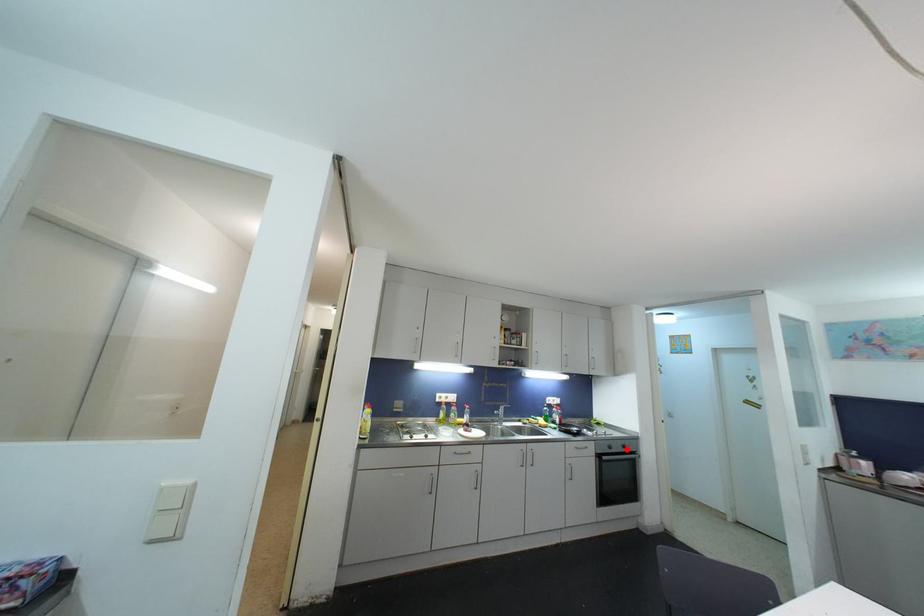
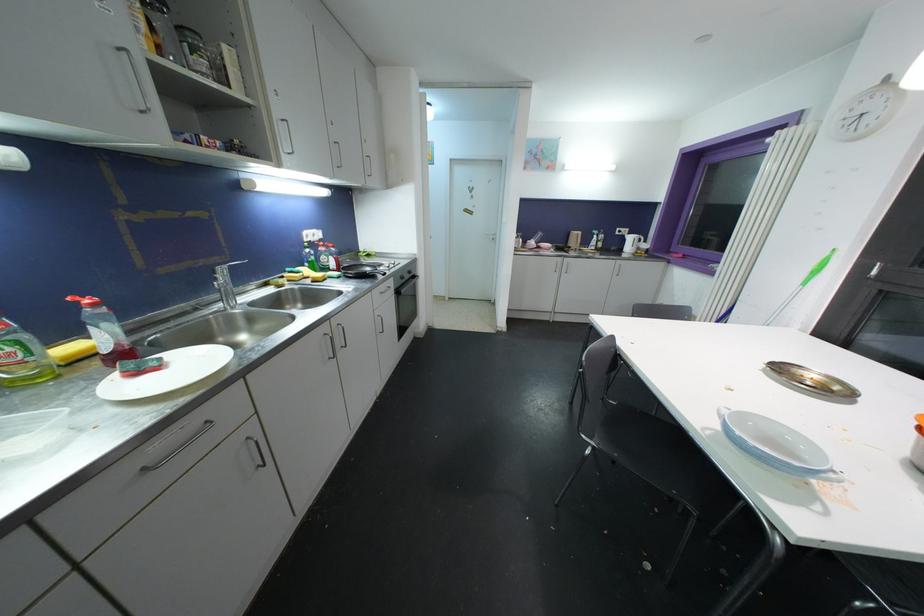
Locate, in the second image, the point that corresponds to the highlighted location in the first image.

(412, 275)